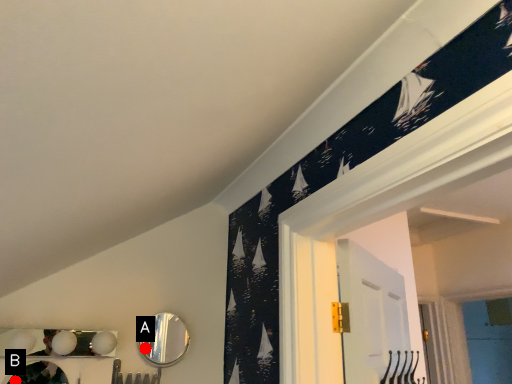
Question: Two points are circled on the image, labeled by A and B beside each circle. Which point appears closest to the camera in this image?

Choices:
 (A) A is closer
 (B) B is closer

Answer: (B)